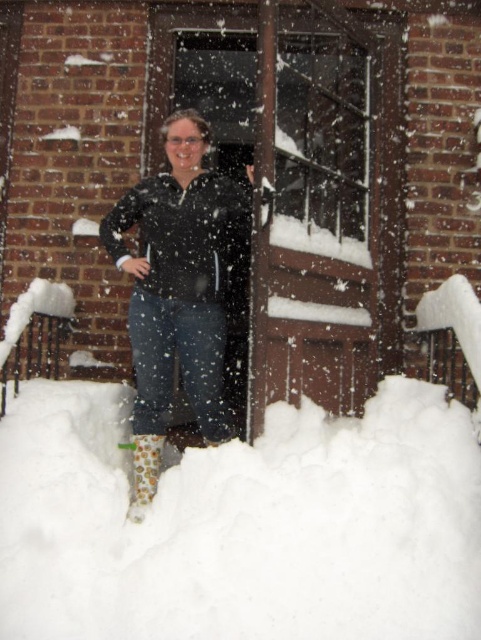
You are standing in the snowy scene and want to walk towards the two points marked in the image. Which point, point [438,570] or point [179,308], will you reach first?

Point [438,570] is closer to the viewer than point [179,308], so you will reach point [438,570] first.

You are a delivery person trying to deliver a package to the door in the snowy scene. The GPS shows a point at coordinate (243, 525). Where is this point located in relation to the door?

The point at coordinate (243, 525) is on white fluffy snow at lower center, which is near the door since it is at the lower part of the image. However, the exact location relative to the door requires checking the scene description for more details.